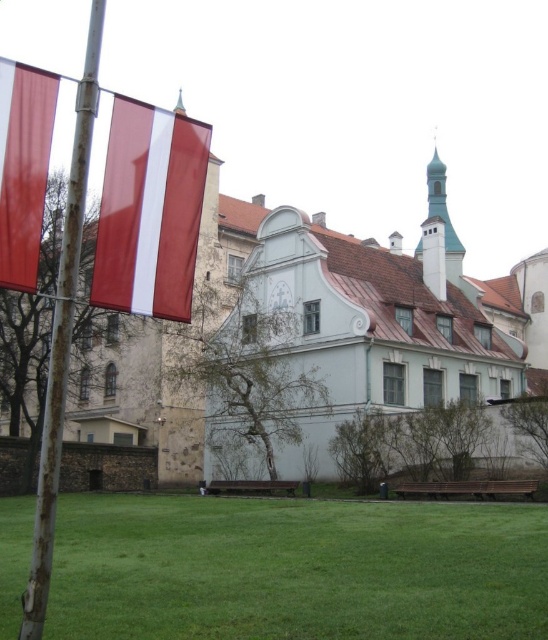
Question: Can you confirm if green grass at lower center is positioned below red glossy flag at upper left?

Choices:
 (A) yes
 (B) no

Answer: (A)

Question: Can you confirm if red glossy flag at upper left is wider than rusty metal flag pole at left?

Choices:
 (A) yes
 (B) no

Answer: (B)

Question: Where is rusty metal flag pole at left located in relation to matte red flag at left in the image?

Choices:
 (A) above
 (B) below

Answer: (A)

Question: Which point appears farthest from the camera in this image?

Choices:
 (A) (71, 179)
 (B) (150, 292)

Answer: (B)

Question: Which point is closer to the camera?

Choices:
 (A) rusty metal flag pole at left
 (B) red glossy flag at upper left
 (C) green grass at lower center

Answer: (A)

Question: Which object is the closest to the rusty metal flag pole at left?

Choices:
 (A) red glossy flag at upper left
 (B) green grass at lower center

Answer: (A)